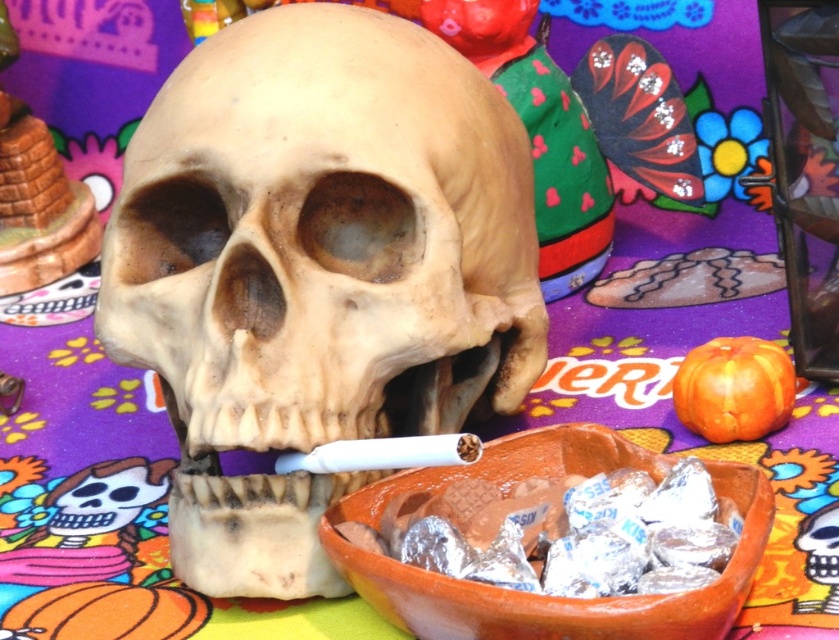
You are standing in front of a DIA DE LOS MUERTOS display. There is a point marked at coordinates [316,269]. Based on the scene description, can you determine what object this point is located on?

The point at coordinates [316,269] is located on the smooth beige skull at center.

You are setting up a DIA DE LOS MUERTOS altar and need to place the smooth beige skull at center and the orange clay bowl at center on a shelf. The shelf has a width of 20 inches. Can both items fit side by side without overlapping?

The smooth beige skull at center is wider than the orange clay bowl at center. Since the shelf is only 20 inches wide, it depends on the combined width of both items. However, since the skull is larger, if their combined width exceeds 20 inches, they won